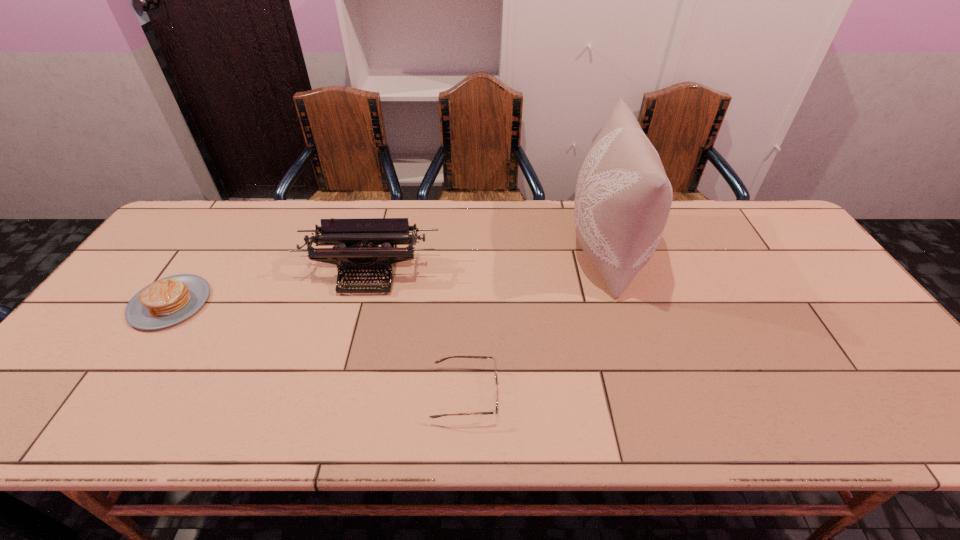
This screenshot has height=540, width=960. I want to click on vacant space at the far right corner of the desktop, so click(x=748, y=204).

I want to click on vacant point located between the cushion and the typewriter, so click(x=488, y=262).

Where is `blank region between the rightmost object and the spectacles`? blank region between the rightmost object and the spectacles is located at coordinates (536, 323).

Find the location of a particular element. The height and width of the screenshot is (540, 960). free space between the spectacles and the tallest object is located at coordinates (536, 323).

You are a GUI agent. You are given a task and a screenshot of the screen. Output one action in this format:
    pyautogui.click(x=<x>, y=<y>)
    Task: Click on the empty location between the spectacles and the leftmost object
    This screenshot has width=960, height=540.
    Given the screenshot: What is the action you would take?
    pyautogui.click(x=318, y=348)

Where is `vacant point located between the typewriter and the rightmost object`? This screenshot has height=540, width=960. vacant point located between the typewriter and the rightmost object is located at coordinates click(x=488, y=262).

The width and height of the screenshot is (960, 540). What are the coordinates of `free space between the typewriter and the leftmost object` in the screenshot? It's located at (270, 288).

Image resolution: width=960 pixels, height=540 pixels. What are the coordinates of `vacant region between the second object from right to left and the third shortest object` in the screenshot? It's located at [418, 334].

Where is `vacant point located between the spectacles and the leftmost object`? The height and width of the screenshot is (540, 960). vacant point located between the spectacles and the leftmost object is located at coordinates [x=318, y=348].

The height and width of the screenshot is (540, 960). I want to click on free space between the spectacles and the pancake, so 318,348.